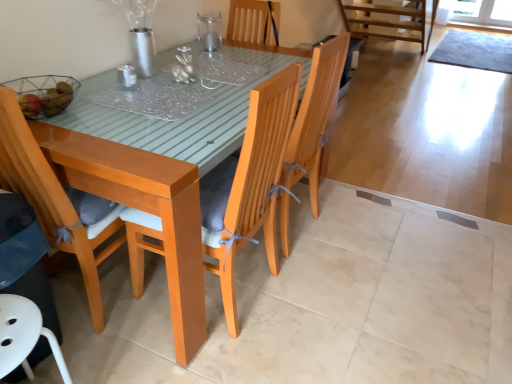
The image size is (512, 384). Find the location of `vacant region to the right of metallic silver candlestick at center, which is counted as the 1th tableware, starting from the bottom`. vacant region to the right of metallic silver candlestick at center, which is counted as the 1th tableware, starting from the bottom is located at coordinates (162, 92).